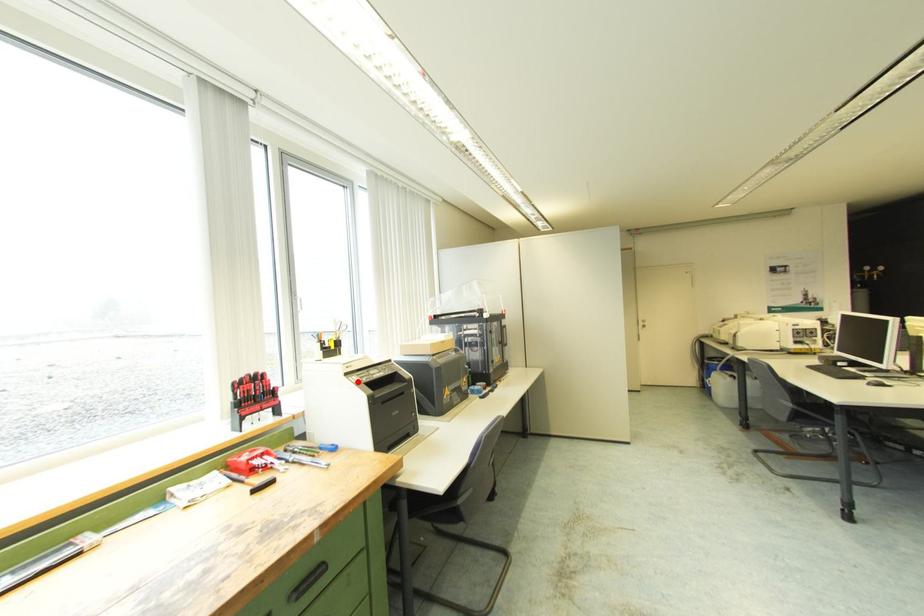
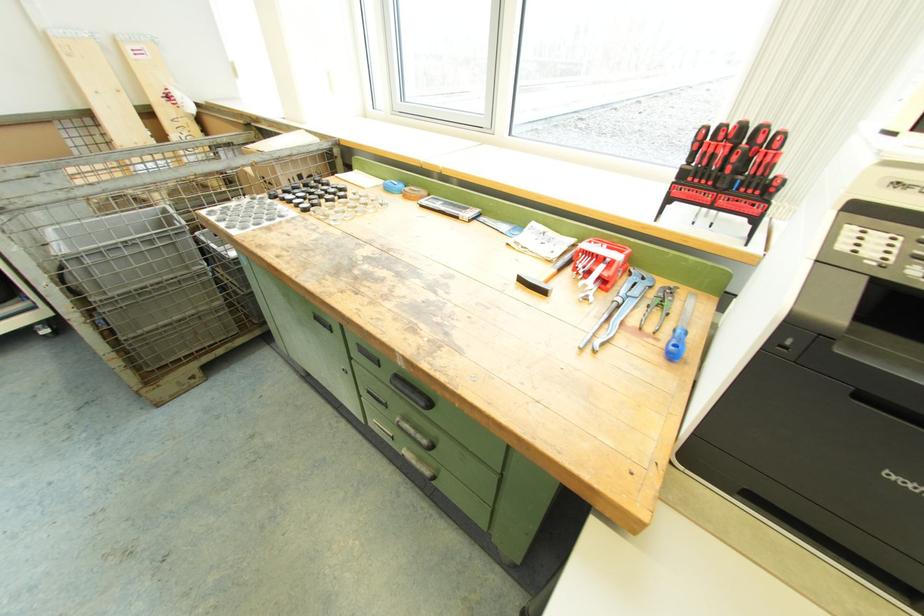
Find the pixel in the second image that matches the highlighted location in the first image.

(847, 246)